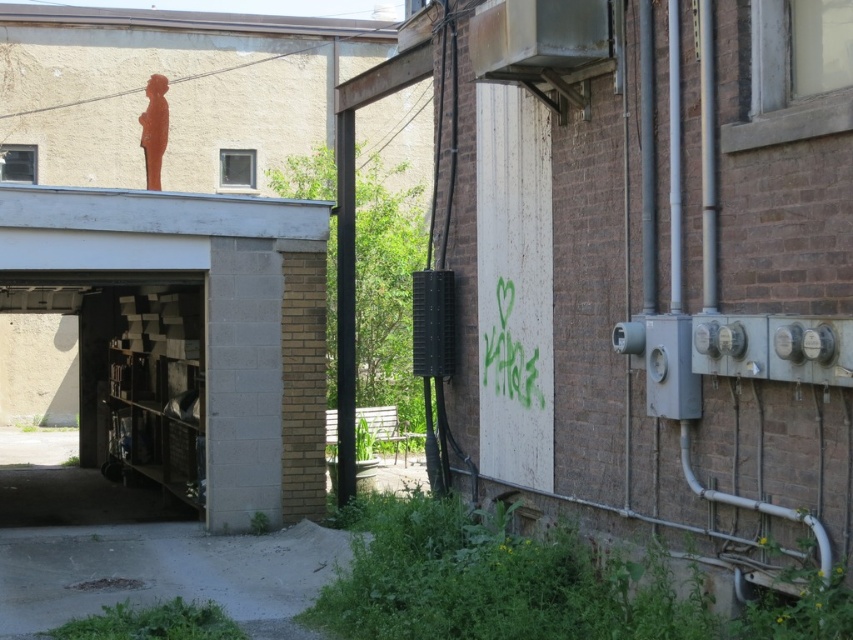
Is point (271, 522) positioned in front of point (196, 364)?

Yes, it is.

Is matte concrete garage at center above metallic gray shelves at lower left?

Yes.

Locate an element on the screen. matte concrete garage at center is located at coordinates (187, 333).